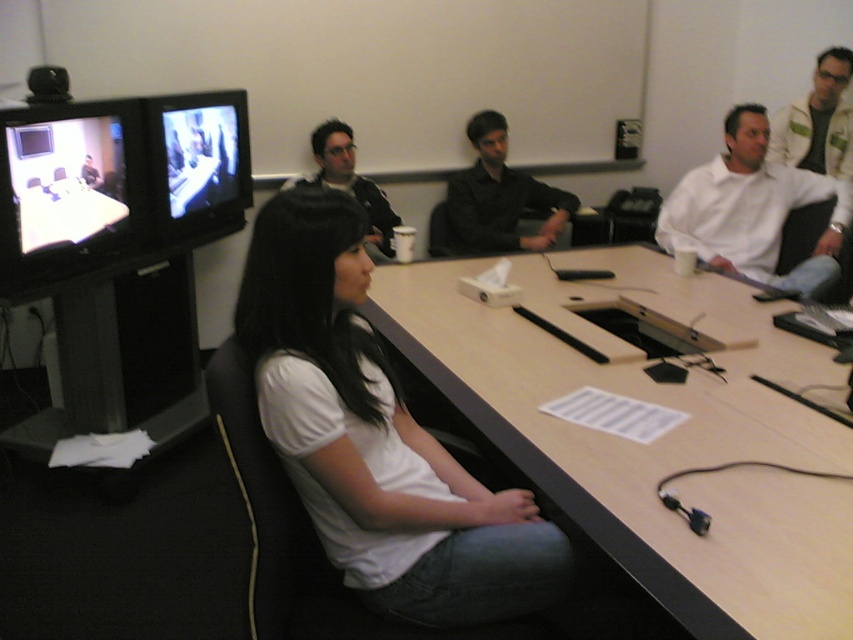
In the scene shown: You are a person sitting at the light brown wood table at center and want to hand a document to someone wearing the white textured jacket at upper right. Which direction should you move to reach them?

The light brown wood table at center is positioned on the left side of white textured jacket at upper right, so you should move to your right to reach the person wearing the white textured jacket at upper right.